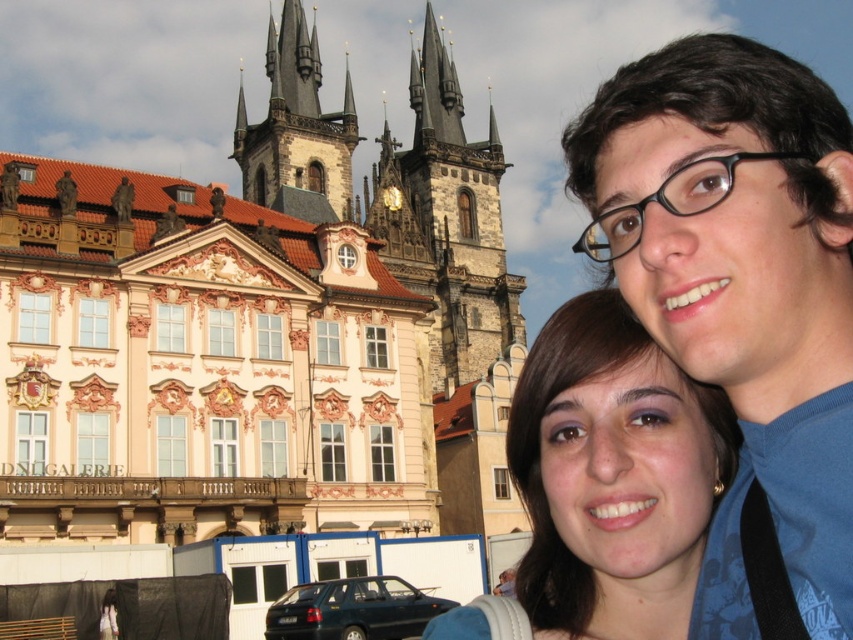
You are standing in the middle of the urban scene described. There is a point marked at coordinates (x=260, y=326). What architectural style does the building located at this point belong to?

The building at point (x=260, y=326) is a dark gray stone church at upper center, which belongs to the Gothic architectural style due to its tall pointed spires characteristic of Gothic architecture.

You are a photographer standing in the urban scene and want to capture both the brown hair at center and the dark gray stone tower at center in a single shot. Which object should you focus on first to ensure both are in frame?

You should focus on the dark gray stone tower at center first because the brown hair at center is located below it, so adjusting the camera angle to include the tower will naturally include the brown hair at center as well.